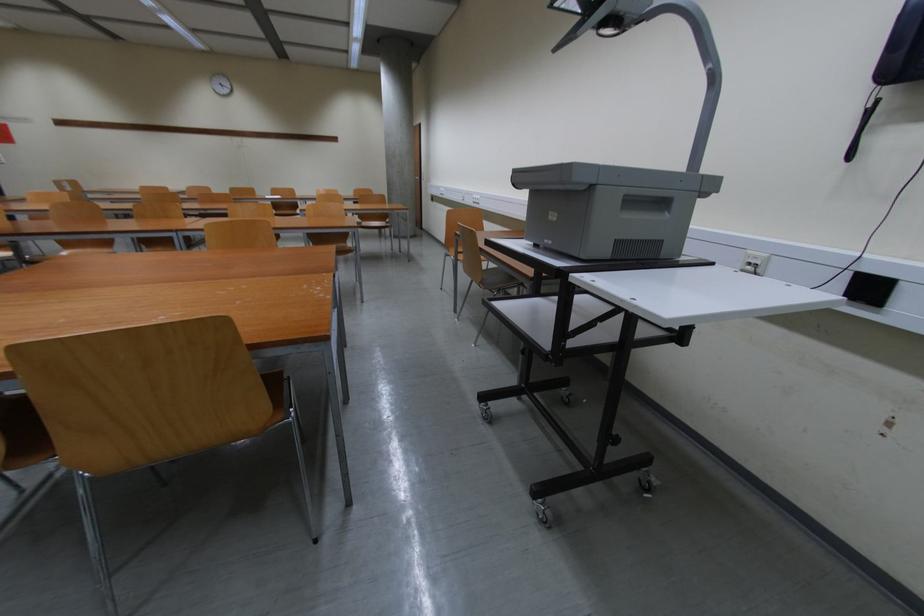
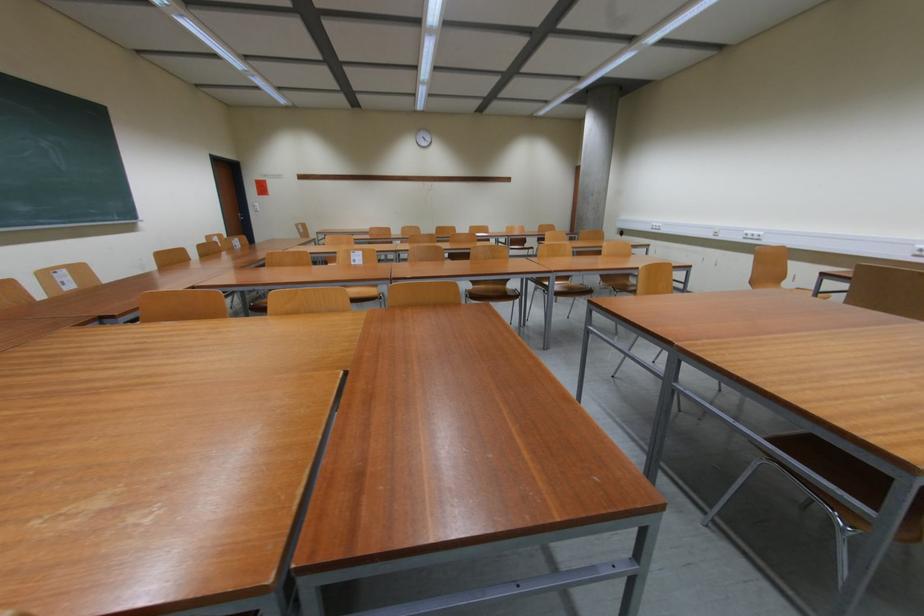
Question: The images are taken continuously from a first-person perspective. In which direction are you moving?

Choices:
 (A) Left
 (B) Right
 (C) Forward
 (D) Backward

Answer: (A)